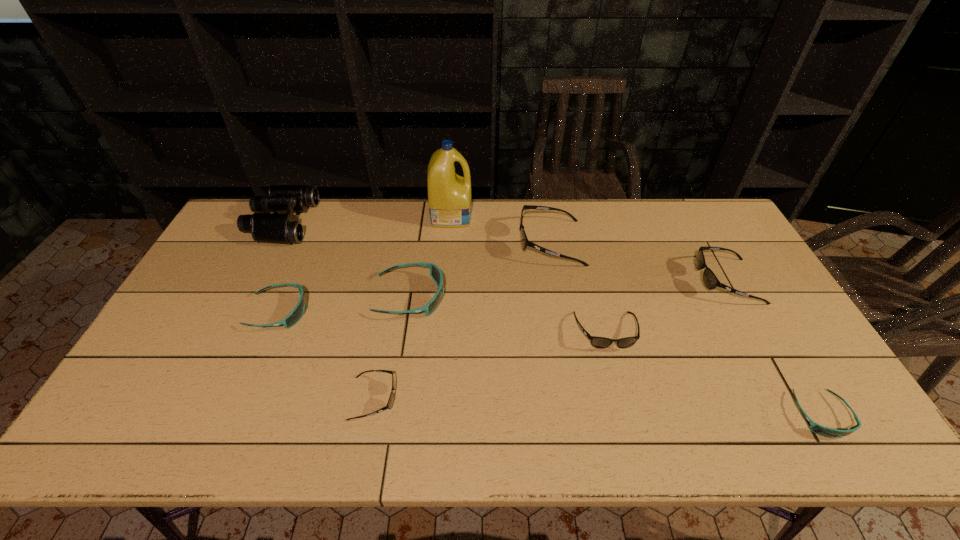
Locate an element on the screen. This screenshot has height=540, width=960. vacant space located on the front-facing side of the third smallest gray sunglasses is located at coordinates (589, 281).

You are a GUI agent. You are given a task and a screenshot of the screen. Output one action in this format:
    pyautogui.click(x=<x>, y=<y>)
    Task: Click on the blank space located 0.140m on the front-facing side of the third smallest gray sunglasses
    
    Given the screenshot: What is the action you would take?
    (x=652, y=281)

Where is `free space located 0.140m on the front-facing side of the biggest cyan sunglasses`? The height and width of the screenshot is (540, 960). free space located 0.140m on the front-facing side of the biggest cyan sunglasses is located at coordinates (492, 297).

Locate an element on the screen. The height and width of the screenshot is (540, 960). free spot located 0.100m on the front-facing side of the second smallest gray sunglasses is located at coordinates (619, 387).

Locate an element on the screen. This screenshot has height=540, width=960. vacant space located on the front-facing side of the second smallest cyan sunglasses is located at coordinates (398, 312).

This screenshot has height=540, width=960. In order to click on free space located 0.120m on the front-facing side of the nearest gray sunglasses in this screenshot , I will do `click(444, 398)`.

I want to click on detergent positioned at the far edge, so click(449, 195).

At what (x,y) coordinates should I click in order to perform the action: click on binoculars that is at the far edge. Please return your answer as a coordinate pair (x, y). Looking at the image, I should click on (285, 228).

The height and width of the screenshot is (540, 960). Identify the location of sunglasses that is at the far edge. (525, 242).

The height and width of the screenshot is (540, 960). In order to click on object that is at the left edge in this screenshot , I will do `click(285, 228)`.